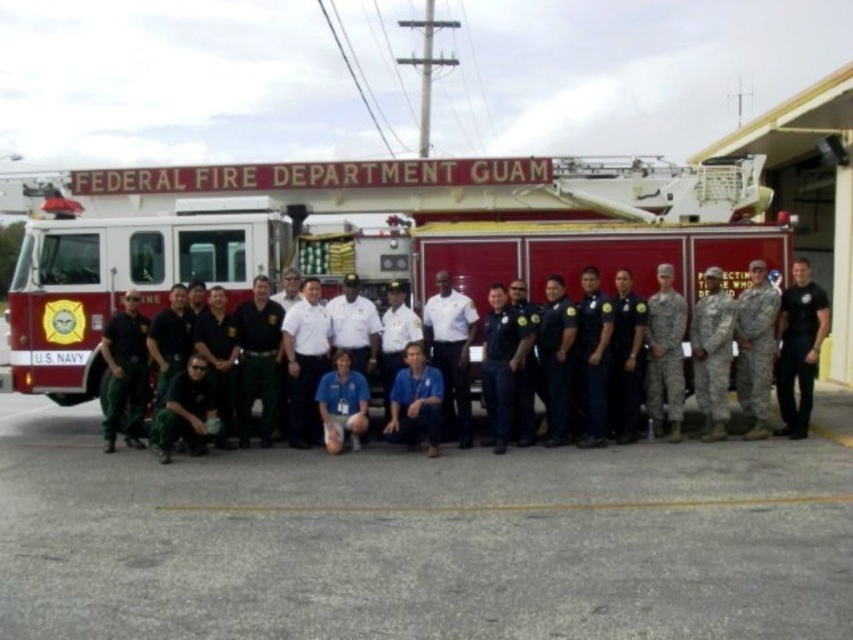
Question: Among these objects, which one is nearest to the camera?

Choices:
 (A) black uniform at center
 (B) dark green uniform at center
 (C) green uniform at center
 (D) camouflage fabric uniform at right

Answer: (C)

Question: Which of the following is the farthest from the observer?

Choices:
 (A) (460, 360)
 (B) (581, 307)
 (C) (759, 420)
 (D) (628, 282)

Answer: (D)

Question: Does black cotton t-shirt at center appear on the right side of dark blue uniform at center?

Choices:
 (A) no
 (B) yes

Answer: (B)

Question: Which point is closer to the camera?

Choices:
 (A) black uniform at center
 (B) dark green uniform at center

Answer: (A)

Question: Does camouflage fabric uniform at right come in front of dark blue uniform at center?

Choices:
 (A) no
 (B) yes

Answer: (A)

Question: Does black cotton t-shirt at center have a smaller size compared to dark green uniform at center?

Choices:
 (A) yes
 (B) no

Answer: (B)